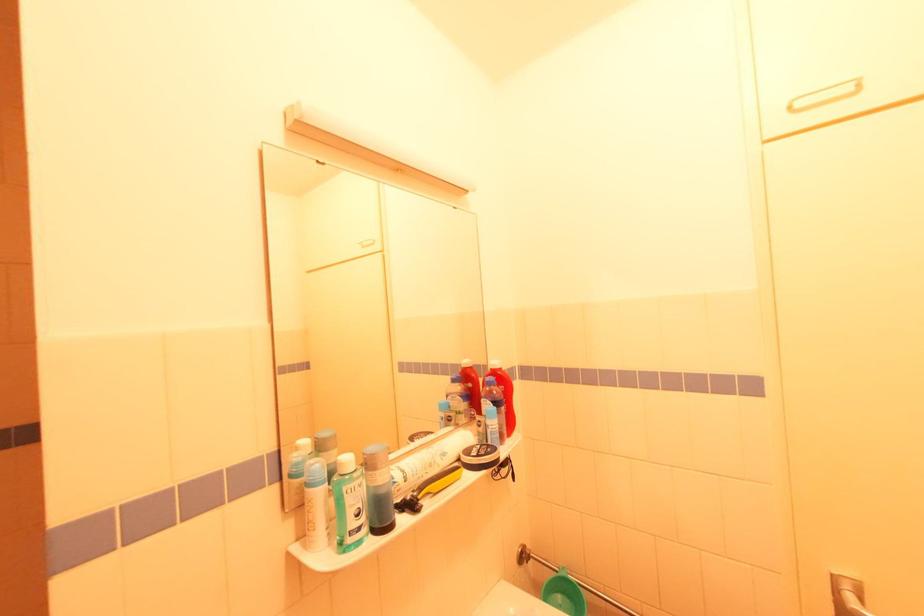
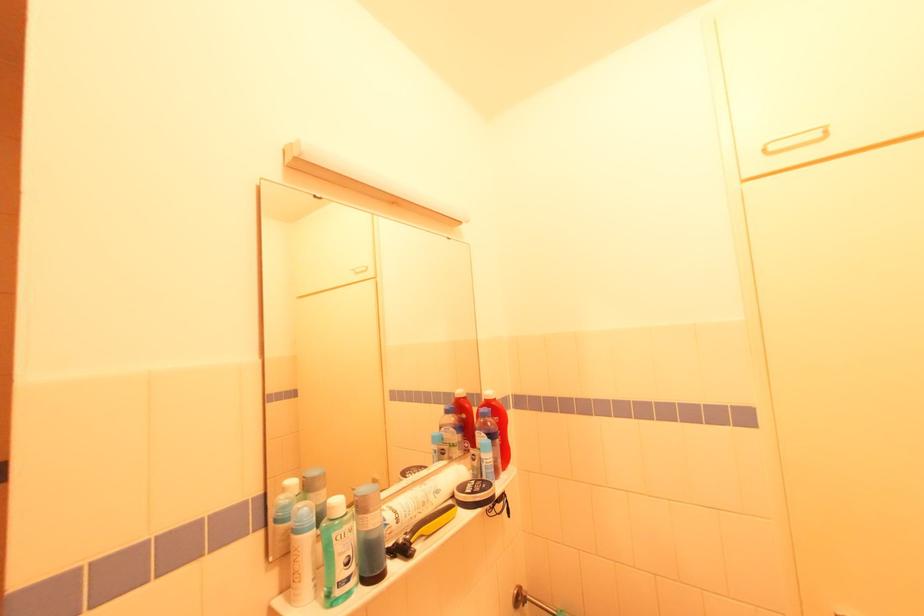
In the second image, find the point that corresponds to the highlighted location in the first image.

(492, 410)